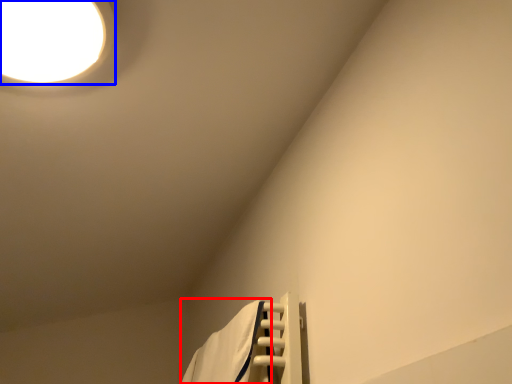
Question: Which object is closer to the camera taking this photo, bath towel (highlighted by a red box) or lamp (highlighted by a blue box)?

Choices:
 (A) bath towel
 (B) lamp

Answer: (B)